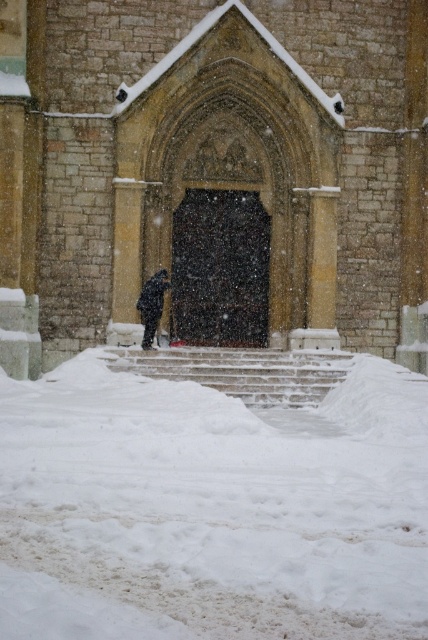
Question: Can you confirm if brown stone church at center is positioned to the left of snow-covered stone stairs at center?

Choices:
 (A) no
 (B) yes

Answer: (B)

Question: Can you confirm if brown stone church at center is positioned below white fluffy snow at center?

Choices:
 (A) yes
 (B) no

Answer: (B)

Question: Estimate the real-world distances between objects in this image. Which object is closer to the snow-covered stone stairs at center?

Choices:
 (A) white fluffy snow at center
 (B) black matte coat at center
 (C) brown stone church at center

Answer: (B)

Question: Does brown stone church at center come in front of black matte coat at center?

Choices:
 (A) no
 (B) yes

Answer: (A)

Question: Which object appears farthest from the camera in this image?

Choices:
 (A) black matte coat at center
 (B) brown stone church at center
 (C) white fluffy snow at center
 (D) snow-covered stone stairs at center

Answer: (B)

Question: Which point is farther from the camera taking this photo?

Choices:
 (A) (216, 468)
 (B) (152, 307)
 (C) (284, 381)

Answer: (B)